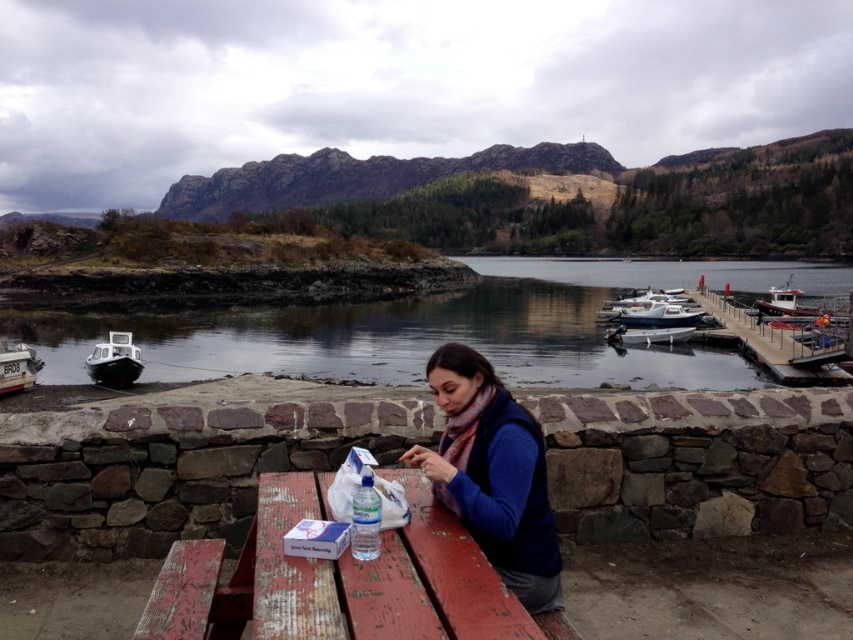
You are standing on the wooden pier and want to board the closest boat. Which boat should you choose between the white glossy boat at left and the white plastic boat at center?

The white glossy boat at left is closer because it is in front of the white plastic boat at center, so you should choose the white glossy boat at left.

You are planning to rent a boat for a short trip on the lake. You see the white glossy boat at left and the white plastic boat at center. Which boat is shorter in height?

The white glossy boat at left is not as tall as the white plastic boat at center, so the white glossy boat at left is shorter in height.